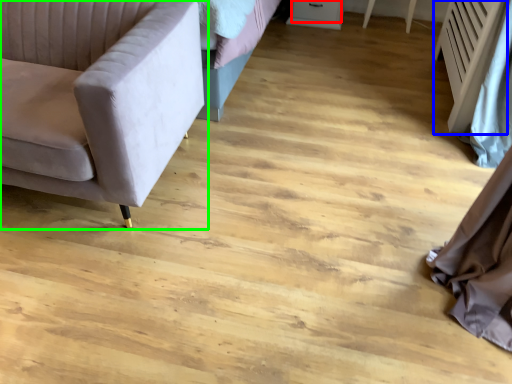
Question: Estimate the real-world distances between objects in this image. Which object is farther from drawer (highlighted by a red box), radiator (highlighted by a blue box) or studio couch (highlighted by a green box)?

Choices:
 (A) radiator
 (B) studio couch

Answer: (B)